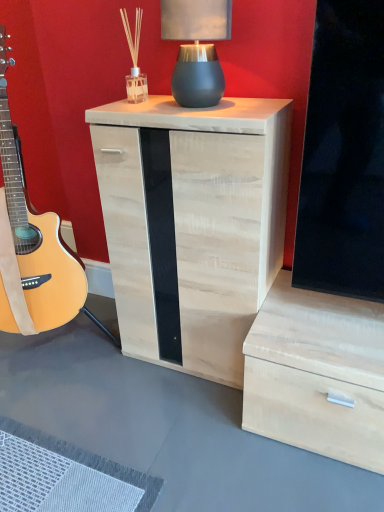
The height and width of the screenshot is (512, 384). What are the coordinates of `free space in front of matte gray ceramic table lamp at upper center` in the screenshot? It's located at (217, 111).